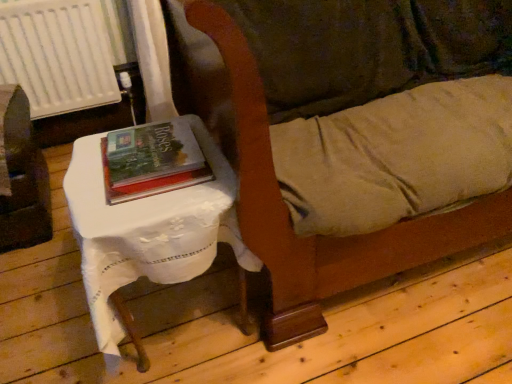
The width and height of the screenshot is (512, 384). Find the location of `white plastic radiator at upper left`. white plastic radiator at upper left is located at coordinates (62, 53).

Image resolution: width=512 pixels, height=384 pixels. Describe the element at coordinates (21, 176) in the screenshot. I see `brushed metal table at left` at that location.

The height and width of the screenshot is (384, 512). What are the coordinates of `hardcover book at center` in the screenshot? It's located at (151, 161).

Can you confirm if white cloth-covered table at left is taller than velvet-like brown couch at center?

No, white cloth-covered table at left is not taller than velvet-like brown couch at center.

Is white cloth-covered table at left positioned behind velvet-like brown couch at center?

Yes, it is behind velvet-like brown couch at center.

What's the angular difference between white plastic radiator at upper left and hardcover book at center's facing directions?

3.13 degrees.

Identify the location of book above the white plastic radiator at upper left (from a real-world perspective). The image size is (512, 384). pyautogui.click(x=151, y=161).

Is white plastic radiator at upper left behind hardcover book at center?

That is True.

From a real-world perspective, between white plastic radiator at upper left and hardcover book at center, who is vertically higher?

hardcover book at center is physically above.

Measure the distance between hardcover book at center and white cloth-covered table at left.

4.17 inches.

Image resolution: width=512 pixels, height=384 pixels. I want to click on table below the hardcover book at center (from the image's perspective), so [147, 234].

Who is more distant, hardcover book at center or white cloth-covered table at left?

hardcover book at center is more distant.

How many degrees apart are the facing directions of hardcover book at center and white cloth-covered table at left?

They differ by 1.37 degrees in their facing directions.

From a real-world perspective, which is physically below, white cloth-covered table at left or white plastic radiator at upper left?

In real-world perspective, white cloth-covered table at left is lower.

How distant is white cloth-covered table at left from white plastic radiator at upper left?

white cloth-covered table at left and white plastic radiator at upper left are 1.20 meters apart from each other.

Between white cloth-covered table at left and white plastic radiator at upper left, which one has larger size?

white cloth-covered table at left is bigger.

Looking at this image, from the image's perspective, between brushed metal table at left and hardcover book at center, who is located below?

From the image's view, hardcover book at center is below.

Which is behind, brushed metal table at left or hardcover book at center?

Positioned behind is brushed metal table at left.

Is hardcover book at center at the back of brushed metal table at left?

brushed metal table at left is not turned away from hardcover book at center.

From a real-world perspective, is hardcover book at center physically below white plastic radiator at upper left?

No, from a real-world perspective, hardcover book at center is not beneath white plastic radiator at upper left.

The image size is (512, 384). Find the location of `radiator above the hardcover book at center (from the image's perspective)`. radiator above the hardcover book at center (from the image's perspective) is located at coordinates (62, 53).

Is white plastic radiator at upper left a part of hardcover book at center?

Definitely not — white plastic radiator at upper left is not inside hardcover book at center.

Is velvet-like brown couch at center far away from hardcover book at center?

No, velvet-like brown couch at center is in close proximity to hardcover book at center.

Can you confirm if velvet-like brown couch at center is smaller than hardcover book at center?

Actually, velvet-like brown couch at center might be larger than hardcover book at center.

Is point (240, 43) closer or farther from the camera than point (135, 171)?

Clearly, point (240, 43) is closer to the camera than point (135, 171).

At what (x,y) coordinates should I click in order to perform the action: click on book that appears below the velvet-like brown couch at center (from the image's perspective). Please return your answer as a coordinate pair (x, y). Image resolution: width=512 pixels, height=384 pixels. Looking at the image, I should click on (151, 161).

Locate an element on the screen. This screenshot has width=512, height=384. table on the left of velvet-like brown couch at center is located at coordinates (147, 234).

In the image, there is a hardcover book at center. Where is `radiator above it (from the image's perspective)`? This screenshot has width=512, height=384. radiator above it (from the image's perspective) is located at coordinates (62, 53).

Based on their spatial positions, is brushed metal table at left or velvet-like brown couch at center closer to hardcover book at center?

velvet-like brown couch at center is positioned closer to the anchor hardcover book at center.

In the scene shown: Looking at the image, which one is located closer to brushed metal table at left, velvet-like brown couch at center or white plastic radiator at upper left?

white plastic radiator at upper left is closer to brushed metal table at left.

Estimate the real-world distances between objects in this image. Which object is further from white cloth-covered table at left, velvet-like brown couch at center or hardcover book at center?

velvet-like brown couch at center.

Which object lies nearer to the anchor point hardcover book at center, white plastic radiator at upper left or brushed metal table at left?

The object closer to hardcover book at center is brushed metal table at left.

Looking at the image, which one is located closer to white cloth-covered table at left, white plastic radiator at upper left or brushed metal table at left?

brushed metal table at left lies closer to white cloth-covered table at left than the other object.

Looking at the image, which one is located further to hardcover book at center, brushed metal table at left or white plastic radiator at upper left?

white plastic radiator at upper left.

Estimate the real-world distances between objects in this image. Which object is closer to velvet-like brown couch at center, hardcover book at center or white plastic radiator at upper left?

hardcover book at center lies closer to velvet-like brown couch at center than the other object.

Estimate the real-world distances between objects in this image. Which object is further from white cloth-covered table at left, white plastic radiator at upper left or hardcover book at center?

Among the two, white plastic radiator at upper left is located further to white cloth-covered table at left.

This screenshot has width=512, height=384. I want to click on book between brushed metal table at left and velvet-like brown couch at center in the horizontal direction, so click(151, 161).

The image size is (512, 384). I want to click on table between brushed metal table at left and hardcover book at center from left to right, so (147, 234).

Identify the location of radiator located between brushed metal table at left and velvet-like brown couch at center in the left-right direction. (62, 53).

Identify the location of book situated between white plastic radiator at upper left and velvet-like brown couch at center from left to right. (151, 161).